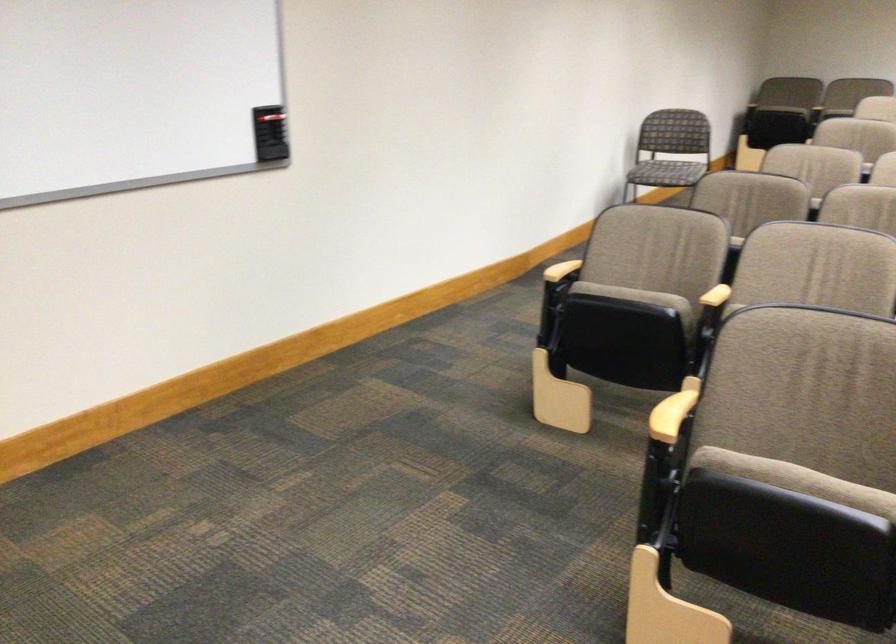
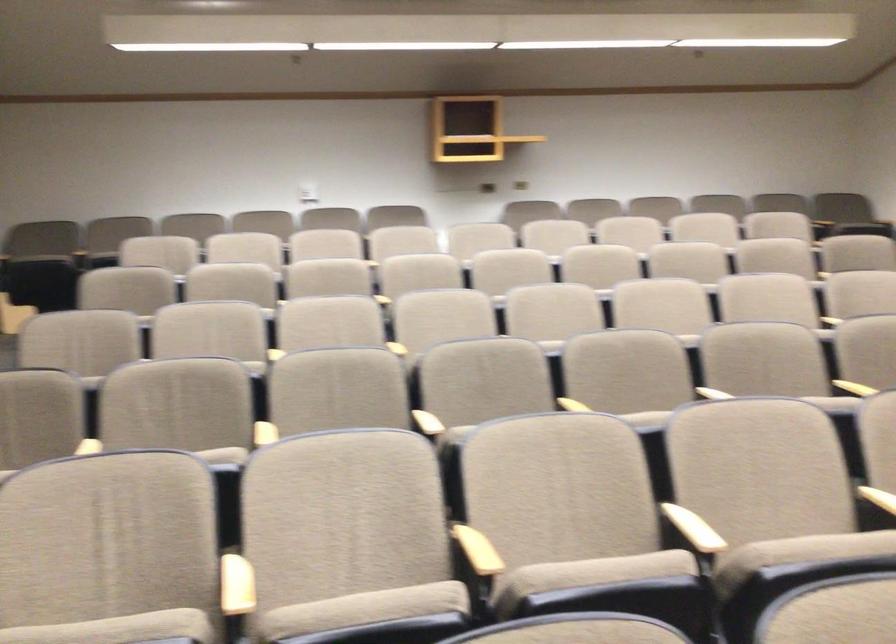
Question: The camera is either moving clockwise (left) or counter-clockwise (right) around the object. The first image is from the beginning of the video and the second image is from the end. Is the camera moving left or right when shooting the video?

Choices:
 (A) Left
 (B) Right

Answer: (A)